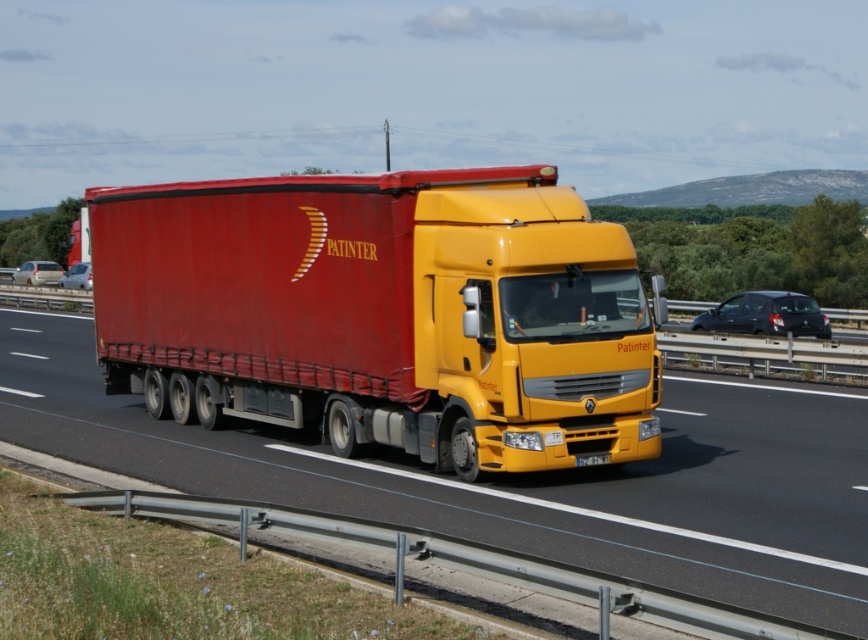
You are a traffic officer observing a highway scene. You notice a matte red trailer truck at center and a matte black car at right. Which vehicle is smaller in size?

The matte red trailer truck at center has a smaller size compared to the matte black car at right, so the matte red trailer truck at center is smaller.

You are a driver in a car behind the large yellow and red truck. You want to overtake the truck on the highway. Is there a silver metallic sedan at point (37,273) in your way? Please explain.

The silver metallic sedan at left is located at point (37,273), so yes, there is a silver metallic sedan at point (37,273) in your way when trying to overtake the truck.

You are a traffic control system analyzing the highway. The highway has three lanes. The leftmost lane is for passing, the middle lane is for through traffic, and the rightmost lane is for exiting. The lanes are each 3.5 meters wide. The center of the highway is at coordinate point 0.5, 0.5. Determine which lane the matte red trailer truck at center is in based on its coordinates.

The matte red trailer truck at center is located at coordinates (382, 314). Since the center of the highway is at (434, 320), the truck is slightly to the left of center. Considering the lanes are each 3.5 meters wide and the truck is near the center, it is most likely in the middle lane designated for through traffic.